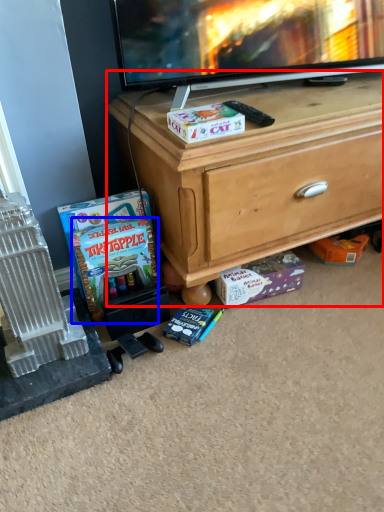
Question: Which point is closer to the camera, desk (highlighted by a red box) or comic book (highlighted by a blue box)?

Choices:
 (A) desk
 (B) comic book

Answer: (A)